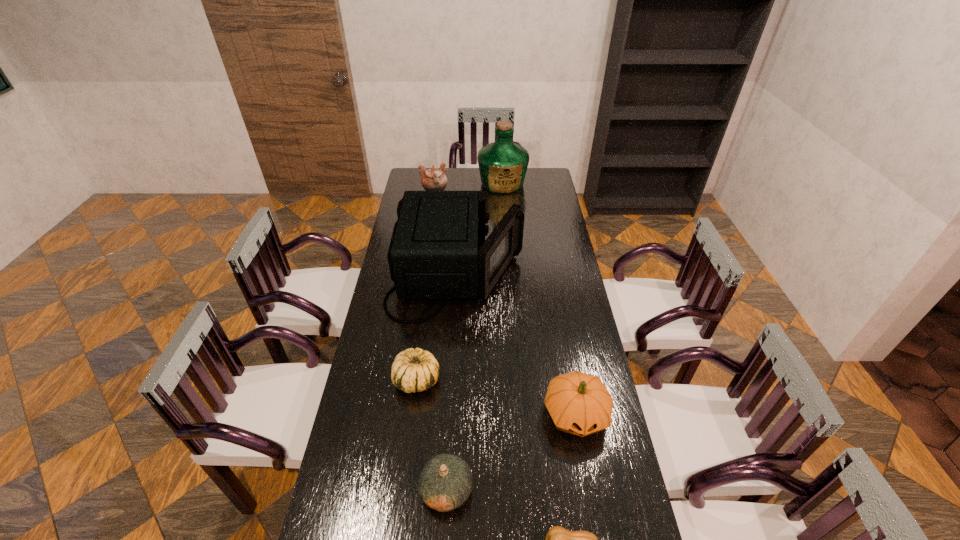
At what (x,y) coordinates should I click in order to perform the action: click on liquor. Please return your answer as a coordinate pair (x, y). Looking at the image, I should click on (502, 164).

This screenshot has width=960, height=540. In order to click on microwave oven in this screenshot , I will do point(434,253).

Where is `the third farthest object`? The width and height of the screenshot is (960, 540). the third farthest object is located at coordinates (434, 253).

Find the location of `urn`. urn is located at coordinates (433, 179).

Identify the location of the fourth shortest object. (579, 403).

The height and width of the screenshot is (540, 960). I want to click on the second nearest object, so click(x=445, y=483).

Image resolution: width=960 pixels, height=540 pixels. Find the location of `blank space located 0.340m on the label side of the tallest object`. blank space located 0.340m on the label side of the tallest object is located at coordinates (506, 234).

At what (x,y) coordinates should I click in order to perform the action: click on vacant space located 0.210m with the door open on the sixth shortest object. Please return your answer as a coordinate pair (x, y). The image size is (960, 540). Looking at the image, I should click on (571, 274).

The image size is (960, 540). Find the location of `free space located on the back of the urn`. free space located on the back of the urn is located at coordinates (437, 189).

Where is `vacant area situated on the side of the fourth shortest object with the carved face`? vacant area situated on the side of the fourth shortest object with the carved face is located at coordinates (597, 533).